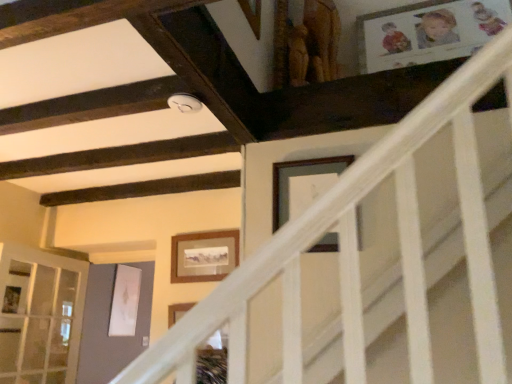
Question: Considering the relative sizes of wooden framed picture at center, the 1th picture frame in the left-to-right sequence, and wooden picture frame at upper center, which ranks as the 2th picture frame in bottom-to-top order, in the image provided, is wooden framed picture at center, the 1th picture frame in the left-to-right sequence, wider than wooden picture frame at upper center, which ranks as the 2th picture frame in bottom-to-top order,?

Choices:
 (A) no
 (B) yes

Answer: (B)

Question: Does wooden framed picture at center, which appears as the second picture frame when viewed from the right, appear on the left side of wooden picture frame at upper center, the 1th picture frame positioned from the right?

Choices:
 (A) no
 (B) yes

Answer: (B)

Question: Can you confirm if wooden framed picture at center, which appears as the second picture frame when viewed from the right, is thinner than wooden picture frame at upper center, which is the 1th picture frame in front-to-back order?

Choices:
 (A) no
 (B) yes

Answer: (A)

Question: Could you tell me if wooden framed picture at center, which appears as the second picture frame when viewed from the right, is turned towards wooden picture frame at upper center, which is the 1th picture frame in front-to-back order?

Choices:
 (A) yes
 (B) no

Answer: (B)

Question: Can wooden picture frame at upper center, the 1th picture frame positioned from the right, be found inside wooden framed picture at center, which appears as the second picture frame when viewed from the right?

Choices:
 (A) yes
 (B) no

Answer: (B)

Question: From the image's perspective, is clear glass door at lower left above or below wooden framed picture at center, the 2th picture frame viewed from the front?

Choices:
 (A) below
 (B) above

Answer: (A)

Question: In terms of height, does clear glass door at lower left look taller or shorter compared to wooden framed picture at center, the 1th picture frame in the left-to-right sequence?

Choices:
 (A) tall
 (B) short

Answer: (A)

Question: In the image, is clear glass door at lower left positioned in front of or behind wooden framed picture at center, the 1th picture frame from the bottom?

Choices:
 (A) behind
 (B) front

Answer: (B)

Question: Is clear glass door at lower left inside the boundaries of wooden framed picture at center, the 2th picture frame viewed from the front, or outside?

Choices:
 (A) inside
 (B) outside

Answer: (B)

Question: From the image's perspective, is wooden framed picture at center, arranged as the second picture frame when viewed from the top, positioned above or below clear glass door at lower left?

Choices:
 (A) below
 (B) above

Answer: (B)

Question: In the image, is wooden framed picture at center, the 2th picture frame viewed from the front, positioned in front of or behind clear glass door at lower left?

Choices:
 (A) behind
 (B) front

Answer: (A)

Question: From a real-world perspective, is wooden framed picture at center, arranged as the second picture frame when viewed from the top, above or below clear glass door at lower left?

Choices:
 (A) below
 (B) above

Answer: (B)

Question: Is point (182, 278) closer or farther from the camera than point (46, 370)?

Choices:
 (A) farther
 (B) closer

Answer: (B)

Question: Considering the relative positions of wooden picture frame at upper center, placed as the first picture frame when sorted from top to bottom, and wooden framed picture at center, which ranks as the 1th picture frame in back-to-front order, in the image provided, is wooden picture frame at upper center, placed as the first picture frame when sorted from top to bottom, to the left or to the right of wooden framed picture at center, which ranks as the 1th picture frame in back-to-front order,?

Choices:
 (A) right
 (B) left

Answer: (A)

Question: Considering the positions of wooden picture frame at upper center, placed as the first picture frame when sorted from top to bottom, and wooden framed picture at center, which ranks as the 1th picture frame in back-to-front order, in the image, is wooden picture frame at upper center, placed as the first picture frame when sorted from top to bottom, taller or shorter than wooden framed picture at center, which ranks as the 1th picture frame in back-to-front order,?

Choices:
 (A) tall
 (B) short

Answer: (A)